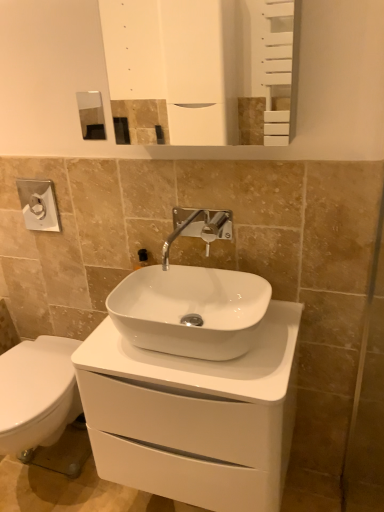
The image size is (384, 512). I want to click on white glossy mirror at upper center, so click(200, 67).

What do you see at coordinates (198, 228) in the screenshot? The width and height of the screenshot is (384, 512). I see `satin nickel faucet at center` at bounding box center [198, 228].

Image resolution: width=384 pixels, height=512 pixels. Find the location of `white glossy sink at center`. white glossy sink at center is located at coordinates click(191, 298).

Identify the location of white glossy mirror at upper center. (200, 67).

At what (x,y) coordinates should I click in order to perform the action: click on mirror that is on the right side of satin nickel faucet at center. Please return your answer as a coordinate pair (x, y). Image resolution: width=384 pixels, height=512 pixels. Looking at the image, I should click on (200, 67).

From the image's perspective, between white glossy mirror at upper center and satin nickel faucet at center, who is located below?

satin nickel faucet at center.

Which is behind, white glossy mirror at upper center or satin nickel faucet at center?

satin nickel faucet at center is further away from the camera.

In order to click on bathroom cabinet that is under the white glossy sink at center (from a real-world perspective) in this screenshot , I will do `click(194, 416)`.

Considering their positions, is white glossy cabinet at center located in front of or behind white glossy sink at center?

Visually, white glossy cabinet at center is located in front of white glossy sink at center.

Is white glossy sink at center located within white glossy cabinet at center?

No.

Does point (87, 342) lie behind point (179, 302)?

No, (87, 342) is closer to viewer.

Considering the points (195, 81) and (195, 453), which point is behind, point (195, 81) or point (195, 453)?

The point (195, 81) is more distant.

Considering the positions of objects white glossy mirror at upper center and white glossy cabinet at center in the image provided, who is more to the left, white glossy mirror at upper center or white glossy cabinet at center?

Positioned to the left is white glossy cabinet at center.

Is white glossy mirror at upper center positioned behind white glossy cabinet at center?

Yes, the depth of white glossy mirror at upper center is greater than that of white glossy cabinet at center.

Is white glossy sink at center far away from white glossy cabinet at center?

white glossy sink at center is actually quite close to white glossy cabinet at center.

From a real-world perspective, is white glossy sink at center above or below white glossy cabinet at center?

Clearly, from a real-world perspective, white glossy sink at center is above white glossy cabinet at center.

How many degrees apart are the facing directions of white glossy sink at center and white glossy cabinet at center?

There is a 0.474-degree angle between the facing directions of white glossy sink at center and white glossy cabinet at center.

Which object is further away from the camera, white glossy sink at center or white glossy cabinet at center?

white glossy sink at center is further away from the camera.

Are satin nickel faucet at center and white glossy mirror at upper center beside each other?

There is a gap between satin nickel faucet at center and white glossy mirror at upper center.

Is satin nickel faucet at center surrounding white glossy mirror at upper center?

Definitely not — white glossy mirror at upper center is not inside satin nickel faucet at center.

Find the location of a particular element. The height and width of the screenshot is (512, 384). tap lying behind the white glossy mirror at upper center is located at coordinates (198, 228).

In the scene shown: Which is correct: white glossy sink at center is inside satin nickel faucet at center, or outside of it?

white glossy sink at center cannot be found inside satin nickel faucet at center.

Which of these two, white glossy sink at center or satin nickel faucet at center, is wider?

With larger width is white glossy sink at center.

Is white glossy sink at center in front of satin nickel faucet at center?

Yes, it is.

Considering the sizes of white glossy sink at center and satin nickel faucet at center in the image, is white glossy sink at center taller or shorter than satin nickel faucet at center?

In the image, white glossy sink at center appears to be shorter than satin nickel faucet at center.

Looking at the image, does satin nickel faucet at center seem bigger or smaller compared to white glossy cabinet at center?

satin nickel faucet at center is smaller than white glossy cabinet at center.

Between point (169, 236) and point (263, 417), which one is positioned in front?

The point (263, 417) is closer to the camera.

You are a GUI agent. You are given a task and a screenshot of the screen. Output one action in this format:
    pyautogui.click(x=<x>, y=<y>)
    Task: Click on the tap above the white glossy cabinet at center (from a real-world perspective)
    Image resolution: width=384 pixels, height=512 pixels.
    Given the screenshot: What is the action you would take?
    pyautogui.click(x=198, y=228)

Locate an element on the screen. The image size is (384, 512). mirror above the satin nickel faucet at center (from a real-world perspective) is located at coordinates (200, 67).

Where is `bathroom cabinet directly beneath the white glossy sink at center (from a real-world perspective)`? The width and height of the screenshot is (384, 512). bathroom cabinet directly beneath the white glossy sink at center (from a real-world perspective) is located at coordinates pyautogui.click(x=194, y=416).

Looking at the image, which one is located further to white glossy cabinet at center, satin nickel faucet at center or white glossy sink at center?

satin nickel faucet at center.

From the image, which object appears to be nearer to satin nickel faucet at center, white glossy mirror at upper center or white glossy sink at center?

Among the two, white glossy sink at center is located nearer to satin nickel faucet at center.

From the image, which object appears to be farther from white glossy sink at center, white glossy mirror at upper center or white glossy cabinet at center?

Among the two, white glossy mirror at upper center is located further to white glossy sink at center.

Which object lies further to the anchor point satin nickel faucet at center, white glossy sink at center or white glossy mirror at upper center?

white glossy mirror at upper center is further to satin nickel faucet at center.

From the image, which object appears to be nearer to white glossy sink at center, white glossy cabinet at center or white glossy mirror at upper center?

white glossy cabinet at center is closer to white glossy sink at center.

Considering their positions, is satin nickel faucet at center positioned closer to white glossy sink at center than white glossy cabinet at center?

satin nickel faucet at center is closer to white glossy sink at center.

Which object lies nearer to the anchor point white glossy mirror at upper center, satin nickel faucet at center or white glossy cabinet at center?

satin nickel faucet at center is positioned closer to the anchor white glossy mirror at upper center.

When comparing their distances from white glossy cabinet at center, does white glossy mirror at upper center or white glossy sink at center seem closer?

Among the two, white glossy sink at center is located nearer to white glossy cabinet at center.

You are a GUI agent. You are given a task and a screenshot of the screen. Output one action in this format:
    pyautogui.click(x=<x>, y=<y>)
    Task: Click on the sink between satin nickel faucet at center and white glossy cabinet at center from top to bottom
    This screenshot has height=512, width=384.
    Given the screenshot: What is the action you would take?
    pos(191,298)

Locate an element on the screen. tap between white glossy mirror at upper center and white glossy sink at center vertically is located at coordinates (198, 228).

The width and height of the screenshot is (384, 512). What are the coordinates of `sink between white glossy mirror at upper center and white glossy cabinet at center from top to bottom` in the screenshot? It's located at (191, 298).

This screenshot has width=384, height=512. I want to click on tap between white glossy mirror at upper center and white glossy cabinet at center in the vertical direction, so click(198, 228).